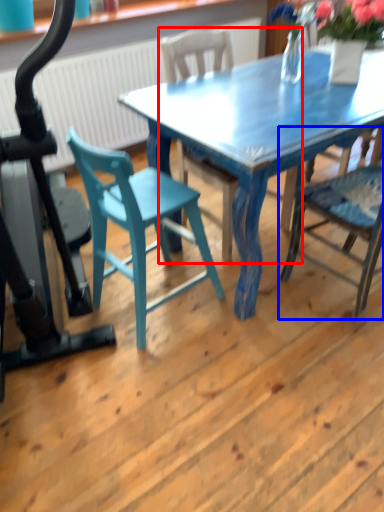
Question: Among these objects, which one is nearest to the camera, chair (highlighted by a red box) or chair (highlighted by a blue box)?

Choices:
 (A) chair
 (B) chair

Answer: (B)